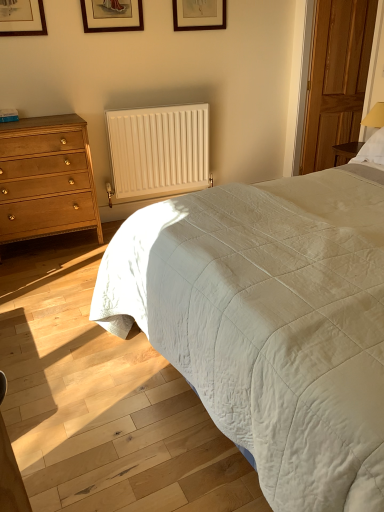
You are a GUI agent. You are given a task and a screenshot of the screen. Output one action in this format:
    pyautogui.click(x=<x>, y=<y>)
    Task: Click on the vacant region above matte wood chest of drawers at left (from a real-world perspective)
    The image size is (384, 512).
    Given the screenshot: What is the action you would take?
    pyautogui.click(x=39, y=120)